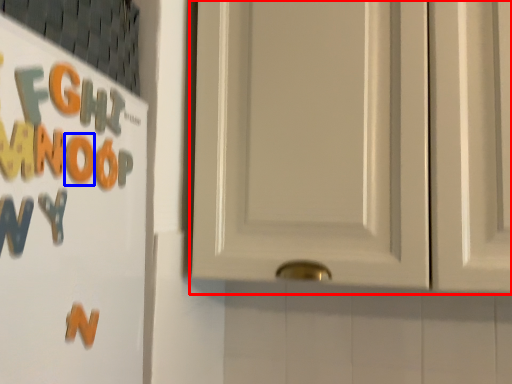
Question: Which object appears closest to the camera in this image, door (highlighted by a red box) or letter (highlighted by a blue box)?

Choices:
 (A) door
 (B) letter

Answer: (B)